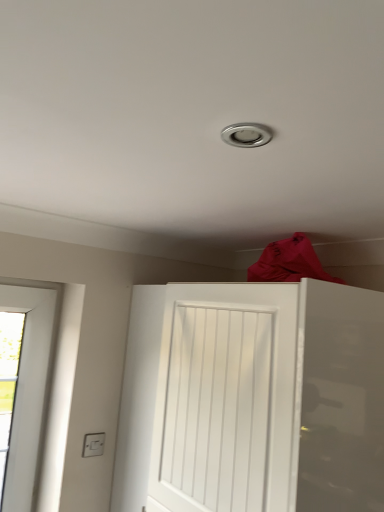
The image size is (384, 512). Find the location of `white plastic electric outlet at lower left`. white plastic electric outlet at lower left is located at coordinates (93, 444).

This screenshot has height=512, width=384. Describe the element at coordinates (93, 444) in the screenshot. I see `white plastic electric outlet at lower left` at that location.

Measure the distance between point (89, 454) and camera.

Point (89, 454) is 5.42 feet away from camera.

This screenshot has height=512, width=384. Describe the element at coordinates (252, 399) in the screenshot. I see `white matte door at center` at that location.

At what (x,y) coordinates should I click in order to perform the action: click on white matte door at center. Please return your answer as a coordinate pair (x, y). The height and width of the screenshot is (512, 384). Looking at the image, I should click on (252, 399).

Find the location of a particular element. Image resolution: width=384 pixels, height=512 pixels. white plastic electric outlet at lower left is located at coordinates (93, 444).

Looking at this image, which object is positioned more to the right, white plastic electric outlet at lower left or white matte door at center?

From the viewer's perspective, white matte door at center appears more on the right side.

Considering the positions of objects white plastic electric outlet at lower left and white matte door at center in the image provided, who is in front, white plastic electric outlet at lower left or white matte door at center?

white matte door at center is more forward.

Between point (95, 436) and point (190, 415), which one is positioned in front?

The point (190, 415) is in front.

From the image's perspective, would you say white plastic electric outlet at lower left is shown under white matte door at center?

Yes.

From a real-world perspective, is white plastic electric outlet at lower left on white matte door at center?

No, from a real-world perspective, white plastic electric outlet at lower left is not on top of white matte door at center.

Does white plastic electric outlet at lower left have a lesser width compared to white matte door at center?

Yes, white plastic electric outlet at lower left is thinner than white matte door at center.

Considering the relative sizes of white plastic electric outlet at lower left and white matte door at center in the image provided, is white plastic electric outlet at lower left shorter than white matte door at center?

Yes, white plastic electric outlet at lower left is shorter than white matte door at center.

Considering the relative sizes of white plastic electric outlet at lower left and white matte door at center in the image provided, is white plastic electric outlet at lower left bigger than white matte door at center?

No, white plastic electric outlet at lower left is not bigger than white matte door at center.

Can we say white plastic electric outlet at lower left lies outside white matte door at center?

Yes, white plastic electric outlet at lower left is not within white matte door at center.

Is white plastic electric outlet at lower left not near white matte door at center?

white plastic electric outlet at lower left is near white matte door at center, not far away.

Is white plastic electric outlet at lower left facing away from white matte door at center?

white plastic electric outlet at lower left is not turned away from white matte door at center.

In the image, there is a white plastic electric outlet at lower left. Find the location of `door above it (from the image's perspective)`. door above it (from the image's perspective) is located at coordinates (252, 399).

Does white matte door at center appear on the left side of white plastic electric outlet at lower left?

No, white matte door at center is not to the left of white plastic electric outlet at lower left.

Considering the positions of objects white matte door at center and white plastic electric outlet at lower left in the image provided, who is behind, white matte door at center or white plastic electric outlet at lower left?

white plastic electric outlet at lower left.

Does point (183, 422) lie behind point (89, 450)?

No, it is not.

From the image's perspective, is white matte door at center under white plastic electric outlet at lower left?

No, from the image's perspective, white matte door at center is not below white plastic electric outlet at lower left.

From a real-world perspective, is white matte door at center on top of white plastic electric outlet at lower left?

Yes, from a real-world perspective, white matte door at center is on top of white plastic electric outlet at lower left.

Is white matte door at center wider than white plastic electric outlet at lower left?

Indeed, white matte door at center has a greater width compared to white plastic electric outlet at lower left.

In terms of height, does white matte door at center look taller or shorter compared to white plastic electric outlet at lower left?

Considering their sizes, white matte door at center has more height than white plastic electric outlet at lower left.

Which of these two, white matte door at center or white plastic electric outlet at lower left, is smaller?

Smaller between the two is white plastic electric outlet at lower left.

Is white matte door at center inside the boundaries of white plastic electric outlet at lower left, or outside?

white matte door at center is not enclosed by white plastic electric outlet at lower left.

Are white matte door at center and white plastic electric outlet at lower left located far from each other?

white matte door at center is actually quite close to white plastic electric outlet at lower left.

Is white matte door at center turned away from white plastic electric outlet at lower left?

No, white matte door at center's orientation is not away from white plastic electric outlet at lower left.

Find the location of a particular element. The width and height of the screenshot is (384, 512). electric outlet below the white matte door at center (from the image's perspective) is located at coordinates click(x=93, y=444).

What are the coordinates of `electric outlet below the white matte door at center (from a real-world perspective)` in the screenshot? It's located at (93, 444).

Image resolution: width=384 pixels, height=512 pixels. Identify the location of door located in front of the white plastic electric outlet at lower left. (252, 399).